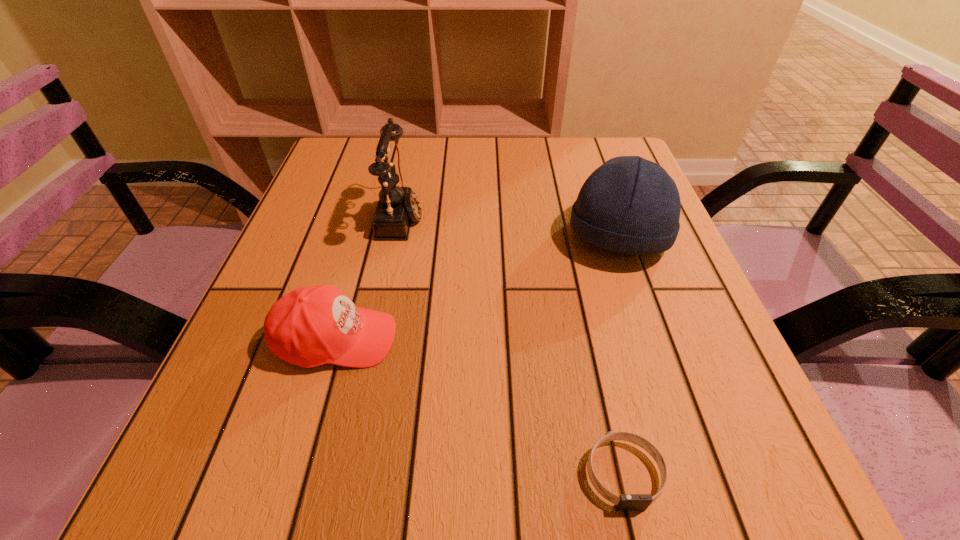
In order to click on telephone in this screenshot , I will do pyautogui.click(x=397, y=206).

Find the location of a particular element. The height and width of the screenshot is (540, 960). skullcap is located at coordinates [x=631, y=205].

I want to click on the third tallest object, so click(310, 326).

In order to click on the third farthest object in this screenshot , I will do `click(310, 326)`.

Locate an element on the screen. wristband is located at coordinates (625, 502).

Find the location of a particular element. the shortest object is located at coordinates (625, 502).

Locate an element on the screen. The width and height of the screenshot is (960, 540). vacant position located 0.330m on the dial of the telephone is located at coordinates point(574,215).

Identify the location of vacant space positioned 0.090m on the left of the second tallest object. This screenshot has width=960, height=540. (524, 237).

You are a GUI agent. You are given a task and a screenshot of the screen. Output one action in this format:
    pyautogui.click(x=<x>, y=<y>)
    Task: Click on the vacant area located 0.100m on the front panel of the second shortest object
    The width and height of the screenshot is (960, 540).
    Given the screenshot: What is the action you would take?
    pyautogui.click(x=457, y=339)

Where is `object at the near edge`? This screenshot has height=540, width=960. object at the near edge is located at coordinates (625, 502).